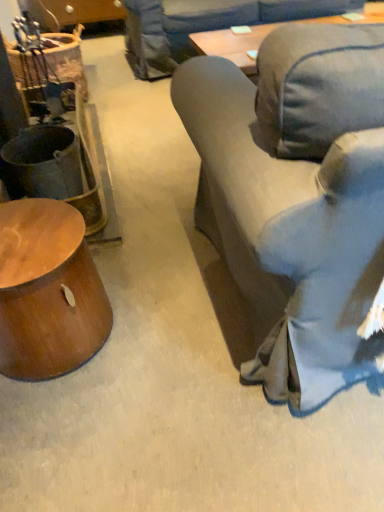
Question: In the image, is shiny brown wood side table at lower left on the left side or the right side of denim fabric couch at right?

Choices:
 (A) left
 (B) right

Answer: (A)

Question: Relative to denim fabric couch at right, is shiny brown wood side table at lower left in front or behind?

Choices:
 (A) behind
 (B) front

Answer: (A)

Question: Is point (39, 202) closer or farther from the camera than point (296, 176)?

Choices:
 (A) closer
 (B) farther

Answer: (B)

Question: Based on their sizes in the image, would you say denim fabric couch at right is bigger or smaller than shiny brown wood side table at lower left?

Choices:
 (A) small
 (B) big

Answer: (B)

Question: Is denim fabric couch at right in front of or behind shiny brown wood side table at lower left in the image?

Choices:
 (A) front
 (B) behind

Answer: (A)

Question: Is point (349, 244) closer or farther from the camera than point (69, 225)?

Choices:
 (A) closer
 (B) farther

Answer: (A)

Question: From the image's perspective, is denim fabric couch at right above or below shiny brown wood side table at lower left?

Choices:
 (A) below
 (B) above

Answer: (B)